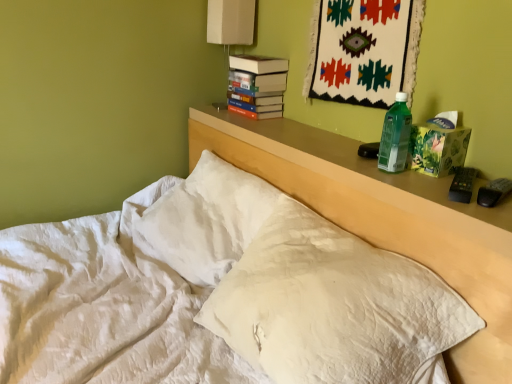
In order to face white quilted bed at center, should I rotate leftwards or rightwards?

You should look left and rotate roughly 11.140 degrees.

Identify the location of white quilted bed at center. (384, 218).

In order to click on hardcover books at upper center in this screenshot , I will do `click(257, 86)`.

Is white fabric lampshade at upper center taller or shorter than green plastic bottle at right?

white fabric lampshade at upper center is taller than green plastic bottle at right.

Is white fabric lampshade at upper center in contact with green plastic bottle at right?

No, white fabric lampshade at upper center is not with green plastic bottle at right.

Consider the image. Which of these two, white fabric lampshade at upper center or green plastic bottle at right, is thinner?

green plastic bottle at right.

Between white fabric lampshade at upper center and green plastic bottle at right, which one has larger size?

With larger size is white fabric lampshade at upper center.

Could you tell me if white fabric lampshade at upper center is turned towards hardcover books at upper center?

No, white fabric lampshade at upper center does not turn towards hardcover books at upper center.

Does point (210, 21) appear closer or farther from the camera than point (260, 85)?

Clearly, point (210, 21) is more distant from the camera than point (260, 85).

Considering the relative sizes of white fabric lampshade at upper center and hardcover books at upper center in the image provided, is white fabric lampshade at upper center smaller than hardcover books at upper center?

Actually, white fabric lampshade at upper center might be larger than hardcover books at upper center.

Is white fabric lampshade at upper center taller or shorter than hardcover books at upper center?

Considering their sizes, white fabric lampshade at upper center has more height than hardcover books at upper center.

Is white quilted pillow at center inside the boundaries of white quilted bed at center, or outside?

white quilted pillow at center is inside white quilted bed at center.

Is point (305, 337) in front of point (346, 176)?

Yes.

Between white quilted pillow at center and white quilted bed at center, which one is positioned behind?

white quilted pillow at center.

What's the angular difference between hardcover books at upper center and green plastic bottle at right's facing directions?

hardcover books at upper center and green plastic bottle at right are facing 5 degrees away from each other.

From the picture: From a real-world perspective, does hardcover books at upper center stand above green plastic bottle at right?

Yes, from a real-world perspective, hardcover books at upper center is above green plastic bottle at right.

Is hardcover books at upper center positioned beyond the bounds of green plastic bottle at right?

Yes, hardcover books at upper center is not within green plastic bottle at right.

Which point is more distant from viewer, [266,69] or [393,118]?

The point [266,69] is farther from the camera.

Is white quilted bed at center inside the boundaries of white quilted pillow at center, or outside?

white quilted bed at center exists outside the volume of white quilted pillow at center.

From a real-world perspective, is white quilted bed at center positioned over white quilted pillow at center based on gravity?

No.

From the image's perspective, is white quilted bed at center located above white quilted pillow at center?

No, from the image's perspective, white quilted bed at center is not above white quilted pillow at center.

Considering the relative sizes of white fabric lampshade at upper center and white quilted bed at center in the image provided, is white fabric lampshade at upper center shorter than white quilted bed at center?

Correct, white fabric lampshade at upper center is not as tall as white quilted bed at center.

Is white fabric lampshade at upper center outside of white quilted bed at center?

Yes, white fabric lampshade at upper center is located beyond the bounds of white quilted bed at center.

From a real-world perspective, is white fabric lampshade at upper center on white quilted bed at center?

Yes, from a real-world perspective, white fabric lampshade at upper center is above white quilted bed at center.

Does white fabric lampshade at upper center have a lesser width compared to white quilted bed at center?

Correct, the width of white fabric lampshade at upper center is less than that of white quilted bed at center.

Is white quilted pillow at center bigger than white fabric lampshade at upper center?

Correct, white quilted pillow at center is larger in size than white fabric lampshade at upper center.

Is white quilted pillow at center touching white fabric lampshade at upper center?

No, white quilted pillow at center is not making contact with white fabric lampshade at upper center.

From the picture: Between white quilted pillow at center and white fabric lampshade at upper center, which one appears on the right side from the viewer's perspective?

white quilted pillow at center.

In the scene shown: Which of these two, white quilted pillow at center or white fabric lampshade at upper center, stands taller?

white quilted pillow at center.

Identify the location of table lamp on the left of green plastic bottle at right. pyautogui.click(x=231, y=22).

Where is `table lamp behind the hardcover books at upper center`? This screenshot has width=512, height=384. table lamp behind the hardcover books at upper center is located at coordinates 231,22.

Estimate the real-world distances between objects in this image. Which object is further from hardcover books at upper center, white quilted bed at center or green plastic bottle at right?

Based on the image, green plastic bottle at right appears to be further to hardcover books at upper center.

Which object lies nearer to the anchor point white fabric lampshade at upper center, white quilted pillow at center or white quilted bed at center?

The object closer to white fabric lampshade at upper center is white quilted bed at center.

Estimate the real-world distances between objects in this image. Which object is closer to hardcover books at upper center, white quilted pillow at center or green plastic bottle at right?

The object closer to hardcover books at upper center is green plastic bottle at right.

Estimate the real-world distances between objects in this image. Which object is further from green plastic bottle at right, white quilted bed at center or white fabric lampshade at upper center?

white fabric lampshade at upper center.

Which object lies nearer to the anchor point white quilted bed at center, white fabric lampshade at upper center or white quilted pillow at center?

Among the two, white quilted pillow at center is located nearer to white quilted bed at center.

From the image, which object appears to be farther from green plastic bottle at right, white quilted pillow at center or white quilted bed at center?

white quilted pillow at center is positioned further to the anchor green plastic bottle at right.

Estimate the real-world distances between objects in this image. Which object is closer to hardcover books at upper center, white quilted bed at center or white quilted pillow at center?

white quilted bed at center is positioned closer to the anchor hardcover books at upper center.

From the image, which object appears to be nearer to white quilted pillow at center, white quilted bed at center or hardcover books at upper center?

white quilted bed at center is closer to white quilted pillow at center.

Where is `pillow positioned between white quilted bed at center and white fabric lampshade at upper center from near to far`? Image resolution: width=512 pixels, height=384 pixels. pillow positioned between white quilted bed at center and white fabric lampshade at upper center from near to far is located at coordinates (333, 306).

The image size is (512, 384). Find the location of `pillow between white quilted bed at center and green plastic bottle at right from front to back`. pillow between white quilted bed at center and green plastic bottle at right from front to back is located at coordinates (333, 306).

The image size is (512, 384). In order to click on bottle positioned between white quilted pillow at center and white fabric lampshade at upper center from near to far in this screenshot , I will do `click(395, 136)`.

Find the location of a particular element. The image size is (512, 384). paperback book between green plastic bottle at right and white fabric lampshade at upper center along the z-axis is located at coordinates (257, 86).